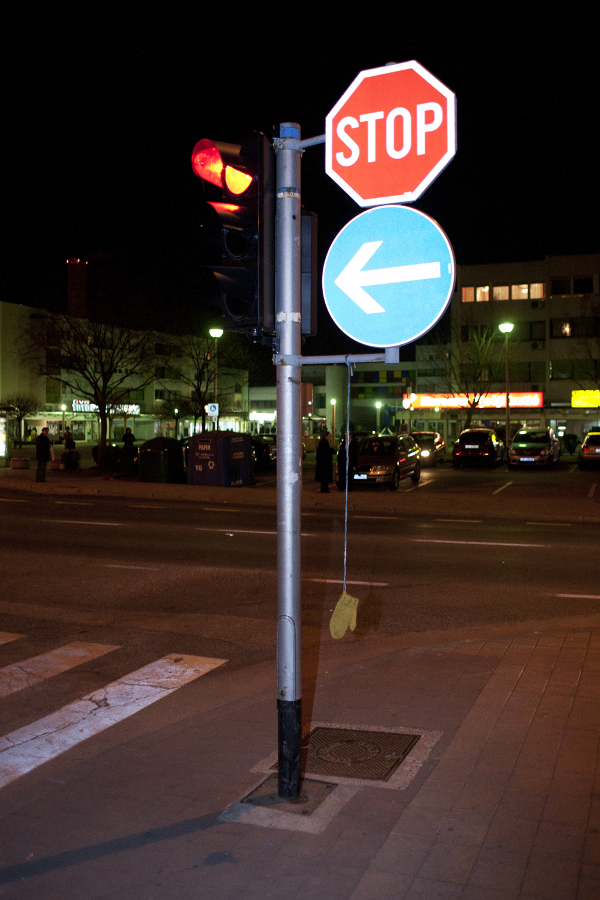
This screenshot has width=600, height=900. Find the location of `grate`. grate is located at coordinates (371, 771).